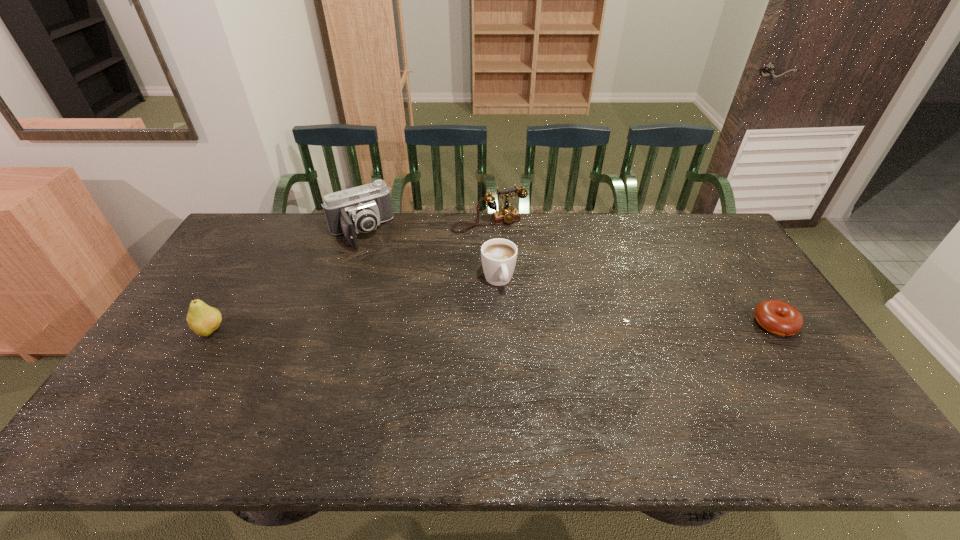
Locate an element on the screen. The image size is (960, 540). vacant space located on the front-facing side of the telephone is located at coordinates coord(525,274).

Image resolution: width=960 pixels, height=540 pixels. What are the coordinates of `vacant region located on the front-facing side of the telephone` in the screenshot? It's located at (543, 305).

Where is `vacant space situated 0.320m with the handle on the side of the cappuccino`? The height and width of the screenshot is (540, 960). vacant space situated 0.320m with the handle on the side of the cappuccino is located at coordinates (534, 382).

I want to click on free space located with the handle on the side of the cappuccino, so click(514, 325).

Locate an element on the screen. free space located 0.080m with the handle on the side of the cappuccino is located at coordinates (510, 315).

The height and width of the screenshot is (540, 960). I want to click on free space located at the front of the camera with an open lens cover, so click(413, 325).

Where is `free space located at the front of the camera with an open lens cover`? This screenshot has height=540, width=960. free space located at the front of the camera with an open lens cover is located at coordinates (396, 297).

This screenshot has height=540, width=960. In order to click on free space located 0.300m at the front of the camera with an open lens cover in this screenshot , I will do [x=401, y=305].

You are a GUI agent. You are given a task and a screenshot of the screen. Output one action in this format:
    pyautogui.click(x=<x>, y=<y>)
    Task: Click on the telephone that is at the far edge
    Image resolution: width=960 pixels, height=540 pixels.
    Given the screenshot: What is the action you would take?
    pyautogui.click(x=506, y=214)

Find the location of a particular element. camera present at the far edge is located at coordinates (360, 209).